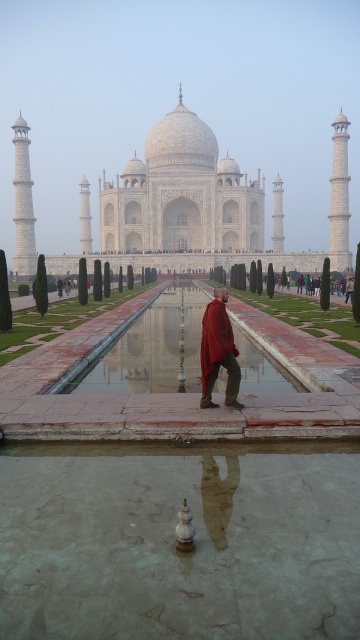
You are standing at the edge of the reflecting pool in front of the Taj Mahal. You want to take a photo of the Taj Mahal without any reflections in the water. Based on the position of the shiny reflective water at center, where should you stand to avoid reflections?

To avoid reflections from the shiny reflective water at center, you should stand to the left or right of the point at coordinates (150, 352) where the reflection is strongest. Moving away from this central point will reduce the reflection in the water.

You are standing at the edge of the reflecting pool at the Taj Mahal. You see the shiny reflective water at center and the red velvet robe at center. Which object is positioned to the left of the other?

The shiny reflective water at center is to the left of the red velvet robe at center.

You are a tourist visiting the Taj Mahal and want to take a photo that includes both the shiny reflective water at center and the red velvet robe at center. Which object should you frame first in your camera to ensure both are fully visible?

You should frame the shiny reflective water at center first because its width is greater than the red velvet robe at center, so capturing it first ensures there is enough space for both in the photo.